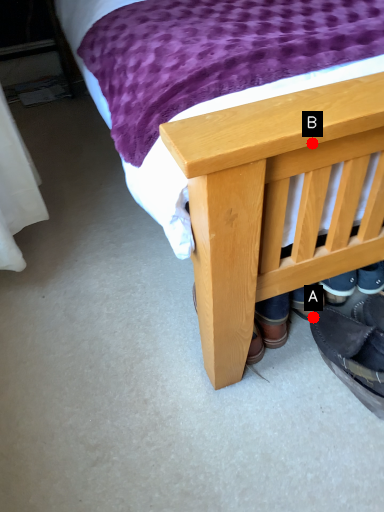
Question: Two points are circled on the image, labeled by A and B beside each circle. Which point is closer to the camera taking this photo?

Choices:
 (A) A is closer
 (B) B is closer

Answer: (B)